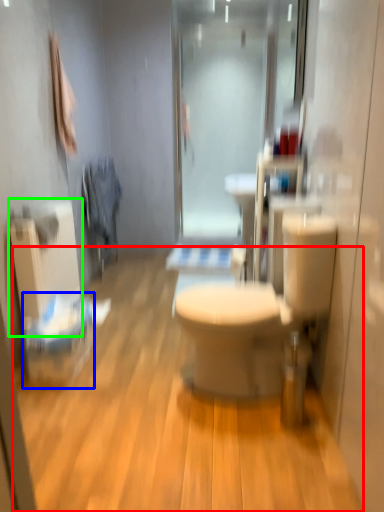
Question: Estimate the real-world distances between objects in this image. Which object is closer to plain (highlighted by a red box), laundry basket (highlighted by a blue box) or radiator (highlighted by a green box)?

Choices:
 (A) laundry basket
 (B) radiator

Answer: (A)